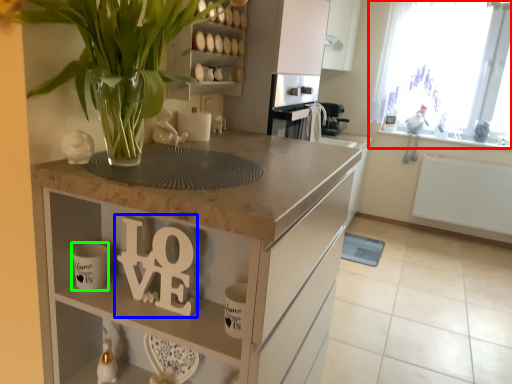
Question: Based on their relative distances, which object is farther from window (highlighted by a red box)? Choose from alphabet (highlighted by a blue box) and mug (highlighted by a green box).

Choices:
 (A) alphabet
 (B) mug

Answer: (B)